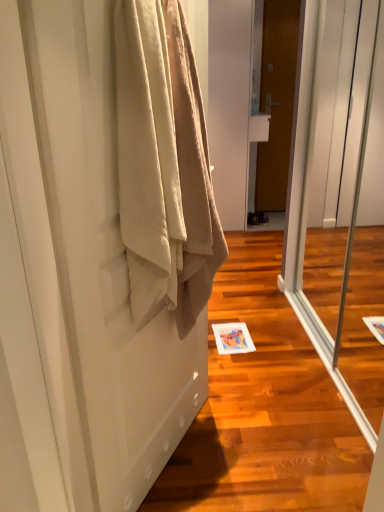
Where is `vacant location below beige fabric door at left, which is the 1th door from front to back (from a real-world perspective)`? Image resolution: width=384 pixels, height=512 pixels. vacant location below beige fabric door at left, which is the 1th door from front to back (from a real-world perspective) is located at coordinates (180, 458).